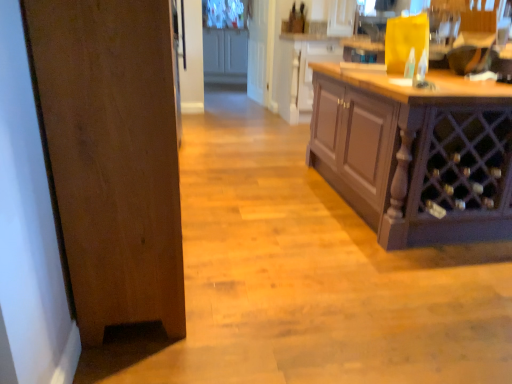
Where is `vacant area that lies to the right of wooden door at left`? vacant area that lies to the right of wooden door at left is located at coordinates (297, 269).